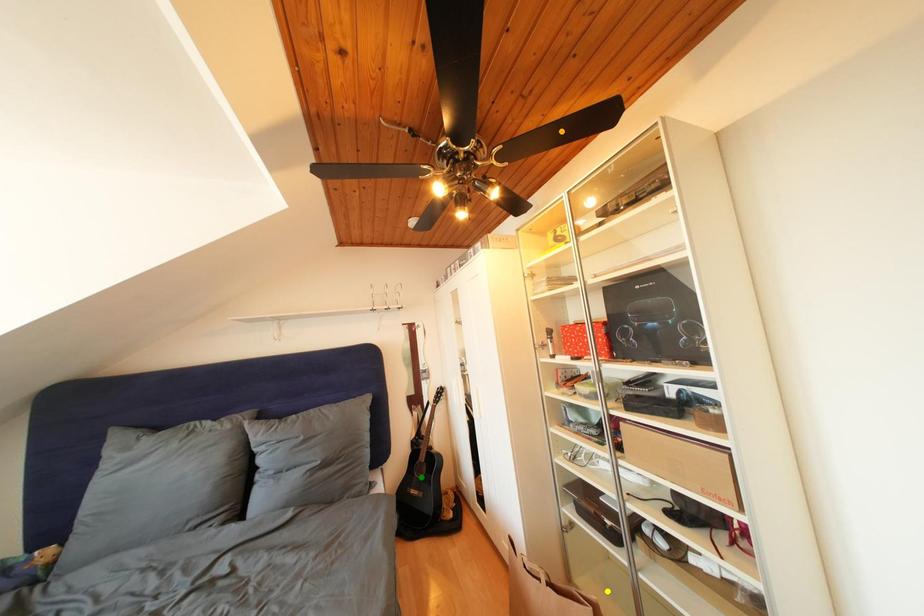
Order these from nearest to farthest:
1. green point
2. yellow point
3. orange point

yellow point, orange point, green point